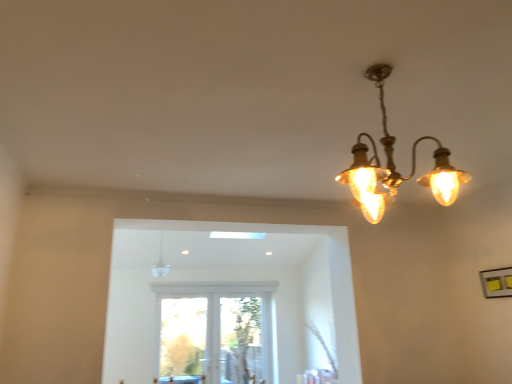
Question: In which direction should I rotate to look at clear glass pendant light at upper center, which is counted as the 2th lamp, starting from the top?

Choices:
 (A) right
 (B) left

Answer: (B)

Question: Does clear glass pendant light at upper center, the first lamp viewed from the back, have a larger size compared to matte brass chandelier at upper right, marked as the second lamp in a back-to-front arrangement?

Choices:
 (A) no
 (B) yes

Answer: (A)

Question: Can you confirm if clear glass pendant light at upper center, placed as the 2th lamp when sorted from front to back, is positioned to the right of matte brass chandelier at upper right, which is the 1th lamp from top to bottom?

Choices:
 (A) yes
 (B) no

Answer: (B)

Question: From a real-world perspective, does clear glass pendant light at upper center, which is counted as the 1th lamp, starting from the bottom, sit lower than matte brass chandelier at upper right, positioned as the first lamp in right-to-left order?

Choices:
 (A) no
 (B) yes

Answer: (A)

Question: Does clear glass pendant light at upper center, the first lamp viewed from the back, contain matte brass chandelier at upper right, marked as the second lamp in a back-to-front arrangement?

Choices:
 (A) no
 (B) yes

Answer: (A)

Question: Could you tell me if clear glass pendant light at upper center, placed as the 2th lamp when sorted from front to back, is turned towards matte brass chandelier at upper right, which is the 1th lamp from top to bottom?

Choices:
 (A) yes
 (B) no

Answer: (A)

Question: From the image's perspective, is clear glass pendant light at upper center, the first lamp positioned from the left, below matte brass chandelier at upper right, positioned as the first lamp in right-to-left order?

Choices:
 (A) no
 (B) yes

Answer: (B)

Question: Could you tell me if matte brass chandelier at upper right, which ranks as the first lamp in front-to-back order, is facing clear glass pendant light at upper center, the 2th lamp viewed from the right?

Choices:
 (A) no
 (B) yes

Answer: (B)

Question: Is matte brass chandelier at upper right, positioned as the first lamp in right-to-left order, bigger than clear glass pendant light at upper center, placed as the 2th lamp when sorted from front to back?

Choices:
 (A) no
 (B) yes

Answer: (B)

Question: Does matte brass chandelier at upper right, which ranks as the first lamp in front-to-back order, have a greater width compared to clear glass pendant light at upper center, the first lamp viewed from the back?

Choices:
 (A) no
 (B) yes

Answer: (B)

Question: From a real-world perspective, does matte brass chandelier at upper right, positioned as the first lamp in right-to-left order, stand above clear glass pendant light at upper center, which is counted as the 1th lamp, starting from the bottom?

Choices:
 (A) yes
 (B) no

Answer: (B)

Question: Does matte brass chandelier at upper right, placed as the 2th lamp when sorted from left to right, touch clear glass pendant light at upper center, the first lamp positioned from the left?

Choices:
 (A) no
 (B) yes

Answer: (A)

Question: Can you confirm if matte brass chandelier at upper right, placed as the 2th lamp when sorted from left to right, is taller than clear glass pendant light at upper center, which is counted as the 1th lamp, starting from the bottom?

Choices:
 (A) no
 (B) yes

Answer: (B)

Question: Is clear glass pendant light at upper center, the first lamp positioned from the left, taller or shorter than matte brass chandelier at upper right, which ranks as the first lamp in front-to-back order?

Choices:
 (A) short
 (B) tall

Answer: (A)